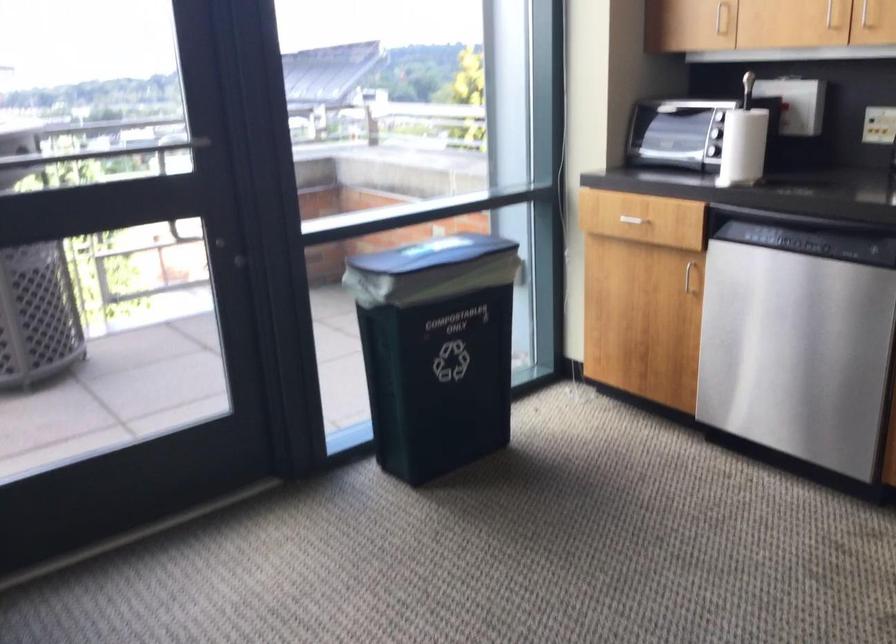
At what (x,y) coordinates should I click in order to perform the action: click on red kit latch. Please return your answer as a coordinate pair (x, y). This screenshot has width=896, height=644. Looking at the image, I should click on (435, 350).